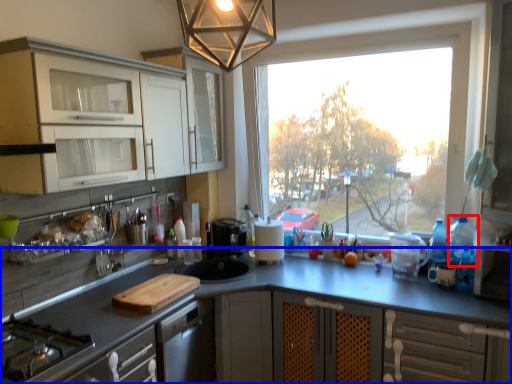
Question: Among these objects, which one is nearest to the camera, appliance (highlighted by a red box) or countertop (highlighted by a blue box)?

Choices:
 (A) appliance
 (B) countertop

Answer: (B)